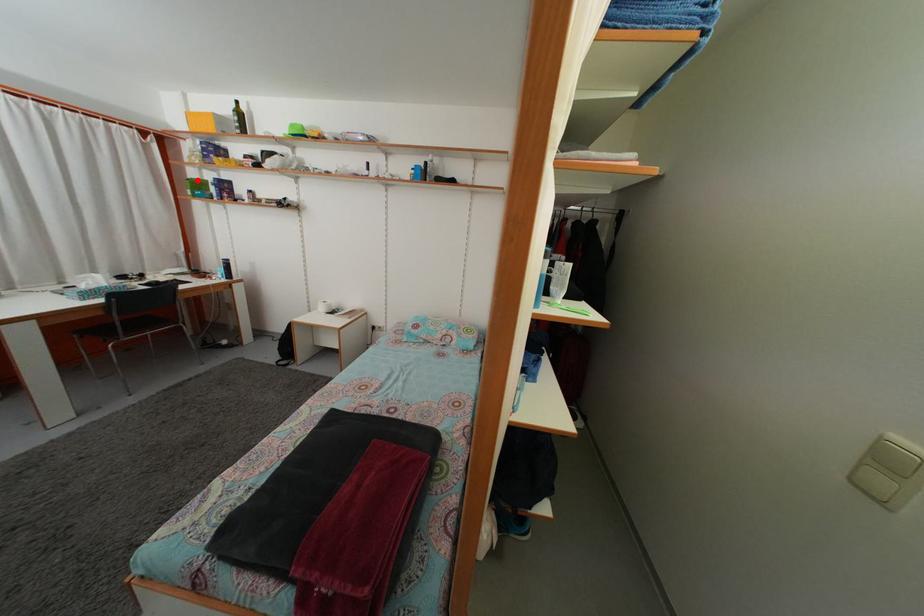
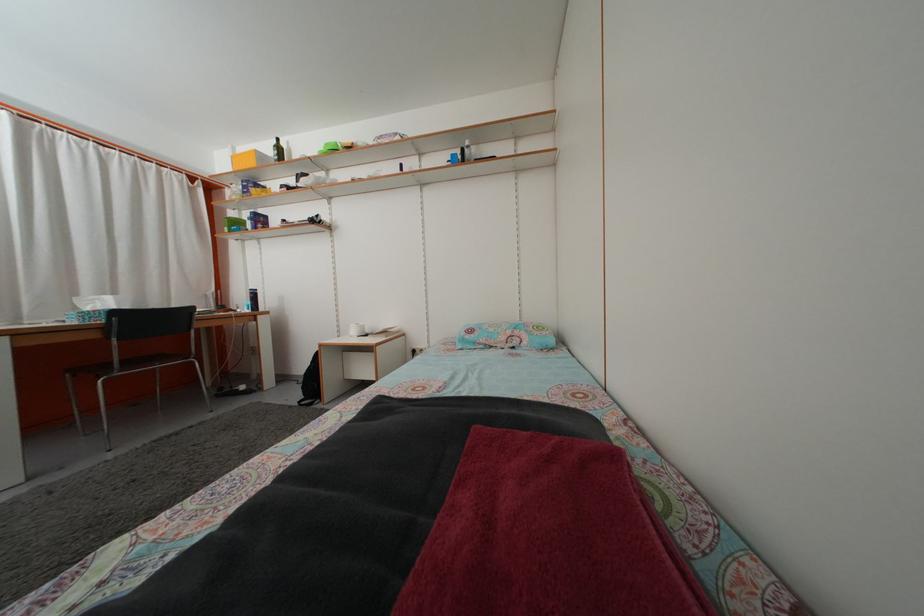
Where in the second image is the point corresponding to the highlighted location from the first image?

(237, 223)